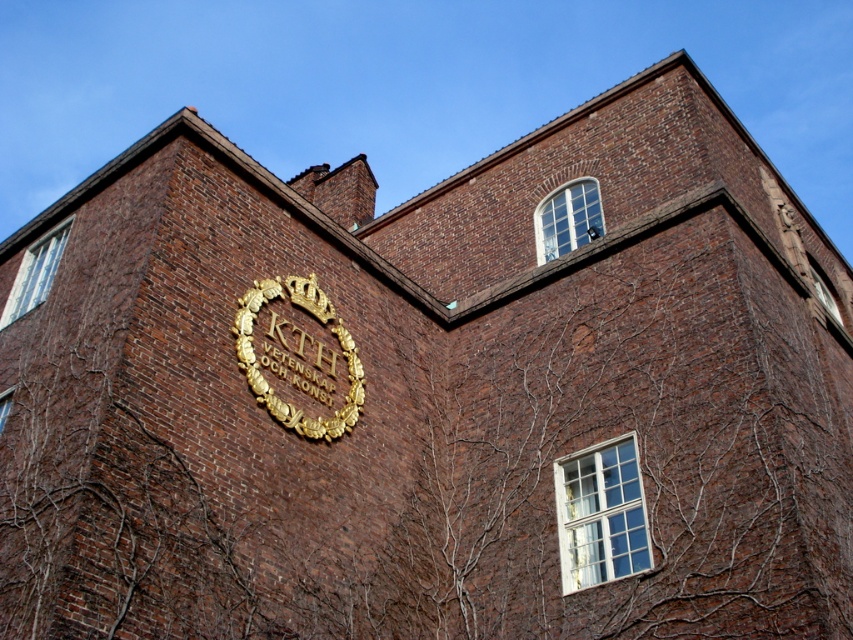
You are standing in front of the brick building and want to locate the white glass window at center. According to the coordinates provided, what are the exact coordinates where you should look to find it?

The white glass window at center is located at the coordinates point (x=601, y=513).

You are an architect analyzing the building facade. You need to determine which window is shorter between the white glass window at center and the clear glass window at lower left. Which one is shorter?

The white glass window at center is shorter than the clear glass window at lower left.

You are standing in front of the brick building and see the point at coordinates (601, 513). Based on the scene description, can you determine which object this point is located on?

The point at coordinates (601, 513) is located on the white glass window at center.